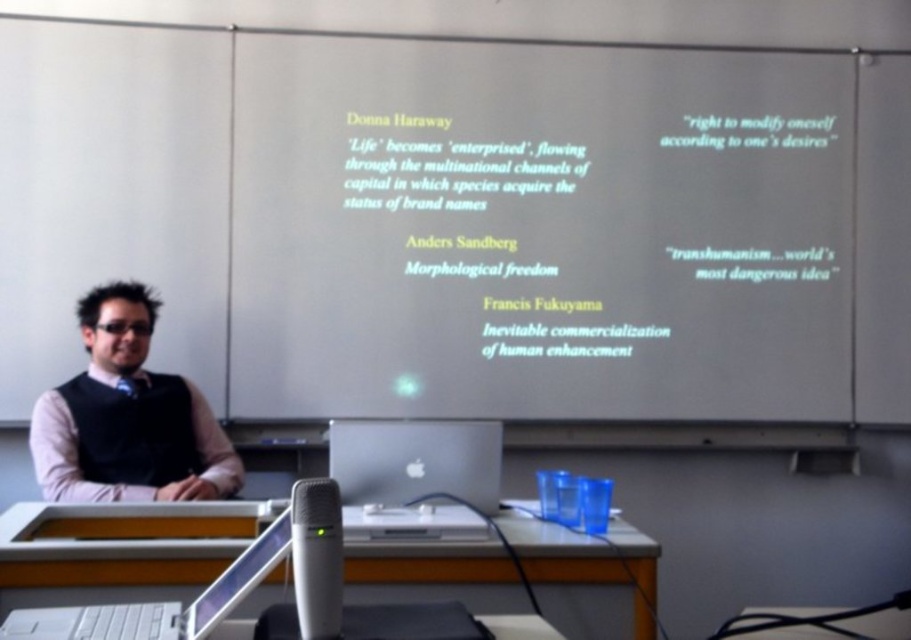
Is matte black vest at left above white plastic laptop at lower center?

Yes.

Which is more to the left, matte black vest at left or white plastic laptop at lower center?

From the viewer's perspective, matte black vest at left appears more on the left side.

Is point (151, 477) more distant than point (101, 608)?

Yes, point (151, 477) is farther from viewer.

I want to click on matte black vest at left, so click(128, 417).

Does white paper at upper center have a smaller size compared to white plastic laptop at lower center?

No, white paper at upper center is not smaller than white plastic laptop at lower center.

Does white paper at upper center appear under white plastic laptop at lower center?

No, white paper at upper center is not below white plastic laptop at lower center.

Between point (256, 202) and point (83, 634), which one is positioned behind?

Positioned behind is point (256, 202).

This screenshot has height=640, width=911. Identify the location of white paper at upper center. (538, 230).

Between point (334, 477) and point (223, 573), which one is positioned behind?

The point (334, 477) is behind.

Is silver metallic computer at center thinner than transparent plastic screen at lower center?

No, silver metallic computer at center is not thinner than transparent plastic screen at lower center.

Is point (394, 500) farther from camera compared to point (239, 593)?

Yes, it is.

Image resolution: width=911 pixels, height=640 pixels. I want to click on silver metallic computer at center, so (415, 460).